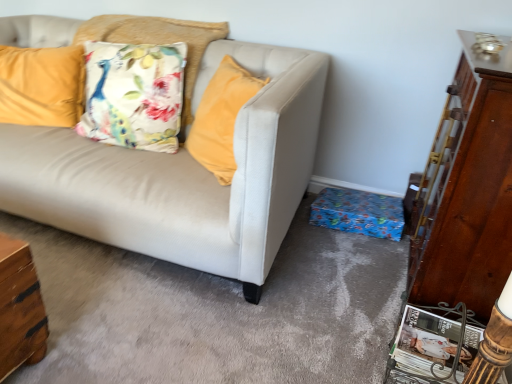
Question: From a real-world perspective, is velvet yellow pillow at upper left, the 2th pillow in the right-to-left sequence, beneath wooden dresser at right?

Choices:
 (A) yes
 (B) no

Answer: (B)

Question: From the image's perspective, would you say velvet yellow pillow at upper left, the 2th pillow in the right-to-left sequence, is shown under wooden dresser at right?

Choices:
 (A) no
 (B) yes

Answer: (A)

Question: Is velvet yellow pillow at upper left, the 2th pillow in the right-to-left sequence, shorter than wooden dresser at right?

Choices:
 (A) no
 (B) yes

Answer: (B)

Question: Is velvet yellow pillow at upper left, the 2th pillow in the right-to-left sequence, positioned behind wooden dresser at right?

Choices:
 (A) no
 (B) yes

Answer: (B)

Question: Are velvet yellow pillow at upper left, the 2th pillow in the right-to-left sequence, and wooden dresser at right beside each other?

Choices:
 (A) yes
 (B) no

Answer: (B)

Question: Looking at their shapes, would you say wooden dresser at right is wider or thinner than floral fabric pillow at upper left, the first pillow viewed from the right?

Choices:
 (A) wide
 (B) thin

Answer: (B)

Question: Relative to floral fabric pillow at upper left, which is the 2th pillow from left to right, is wooden dresser at right in front or behind?

Choices:
 (A) front
 (B) behind

Answer: (A)

Question: Is wooden dresser at right bigger or smaller than floral fabric pillow at upper left, the first pillow viewed from the right?

Choices:
 (A) small
 (B) big

Answer: (B)

Question: From the image's perspective, is wooden dresser at right located above or below floral fabric pillow at upper left, the first pillow viewed from the right?

Choices:
 (A) above
 (B) below

Answer: (B)

Question: Do you think velvet yellow pillow at upper left, the 2th pillow in the right-to-left sequence, is within wooden dresser at right, or outside of it?

Choices:
 (A) outside
 (B) inside

Answer: (A)

Question: Is velvet yellow pillow at upper left, the 2th pillow in the right-to-left sequence, taller or shorter than wooden dresser at right?

Choices:
 (A) tall
 (B) short

Answer: (B)

Question: Relative to wooden dresser at right, is velvet yellow pillow at upper left, the 2th pillow in the right-to-left sequence, in front or behind?

Choices:
 (A) front
 (B) behind

Answer: (B)

Question: From a real-world perspective, is velvet yellow pillow at upper left, the 1th pillow from the left, positioned above or below wooden dresser at right?

Choices:
 (A) below
 (B) above

Answer: (B)

Question: Relative to velvet yellow pillow at upper left, the 1th pillow from the left, is floral fabric pillow at upper left, which is the 2th pillow from left to right, in front or behind?

Choices:
 (A) behind
 (B) front

Answer: (B)

Question: Looking at the image, does floral fabric pillow at upper left, which is the 2th pillow from left to right, seem bigger or smaller compared to velvet yellow pillow at upper left, the 1th pillow from the left?

Choices:
 (A) small
 (B) big

Answer: (B)